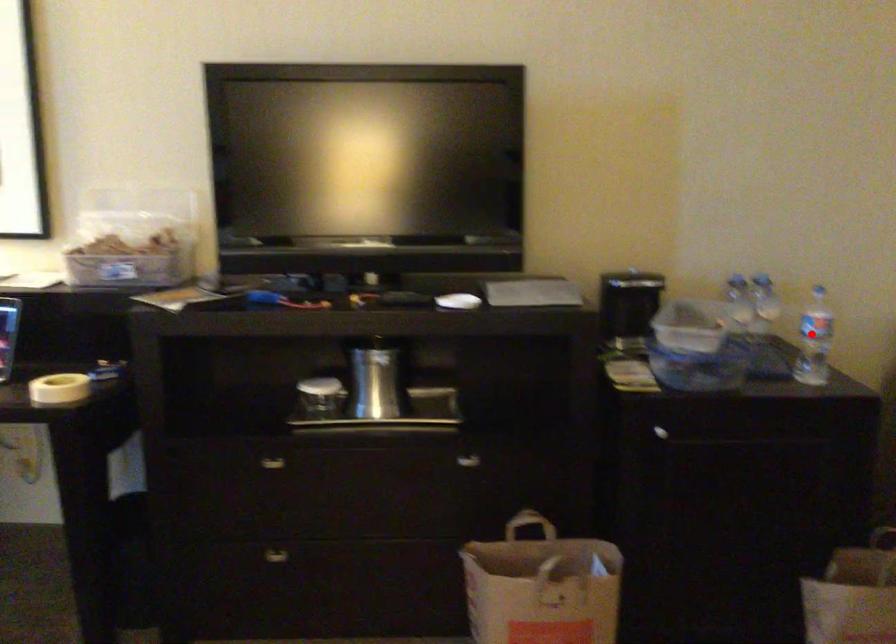
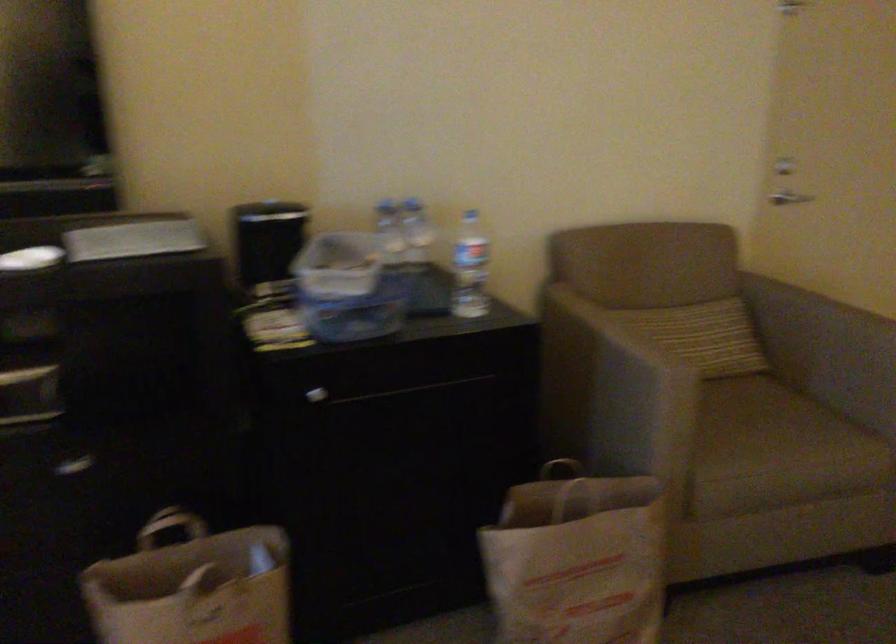
In the second image, find the point that corresponds to the highlighted location in the first image.

(470, 268)